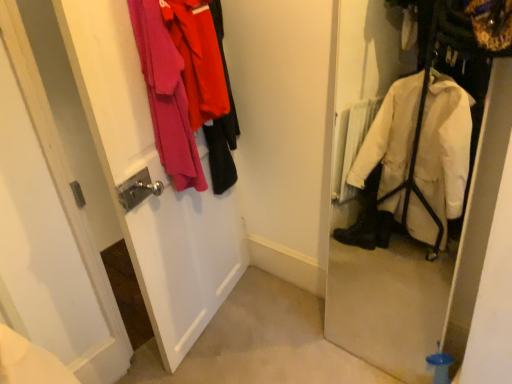
Locate an element on the screen. vacant area located to the right-hand side of white matte door at left is located at coordinates (270, 320).